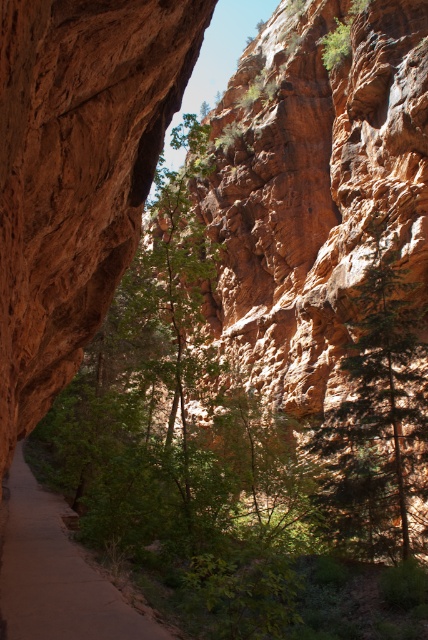
Is green textured tree at right thinner than smooth dirt path at center?

Yes.

Is point (338, 518) closer to viewer compared to point (35, 556)?

No.

Who is more forward, (389, 394) or (68, 536)?

Point (68, 536)

Where is `green textured tree at right`? This screenshot has width=428, height=640. green textured tree at right is located at coordinates (377, 413).